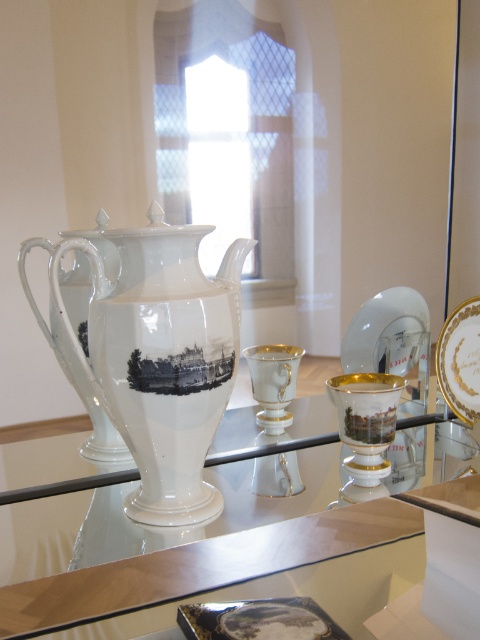
Question: Based on their relative distances, which object is nearer to the transparent glass saucer at right?

Choices:
 (A) transparent glass table at center
 (B) white porcelain teapot at center

Answer: (A)

Question: Does white porcelain teapot at center have a lesser width compared to transparent glass saucer at right?

Choices:
 (A) yes
 (B) no

Answer: (B)

Question: Does white porcelain teapot at center come in front of gold-trimmed porcelain plate at right?

Choices:
 (A) yes
 (B) no

Answer: (A)

Question: Which of these objects is positioned closest to the gold-trimmed porcelain plate at right?

Choices:
 (A) white porcelain teapot at center
 (B) transparent glass table at center
 (C) transparent glass saucer at right

Answer: (C)

Question: Which of these objects is positioned closest to the transparent glass saucer at right?

Choices:
 (A) gold-trimmed porcelain plate at right
 (B) transparent glass table at center
 (C) white porcelain teapot at center

Answer: (A)

Question: Can you confirm if transparent glass saucer at right is positioned to the left of gold-trimmed porcelain plate at right?

Choices:
 (A) yes
 (B) no

Answer: (A)